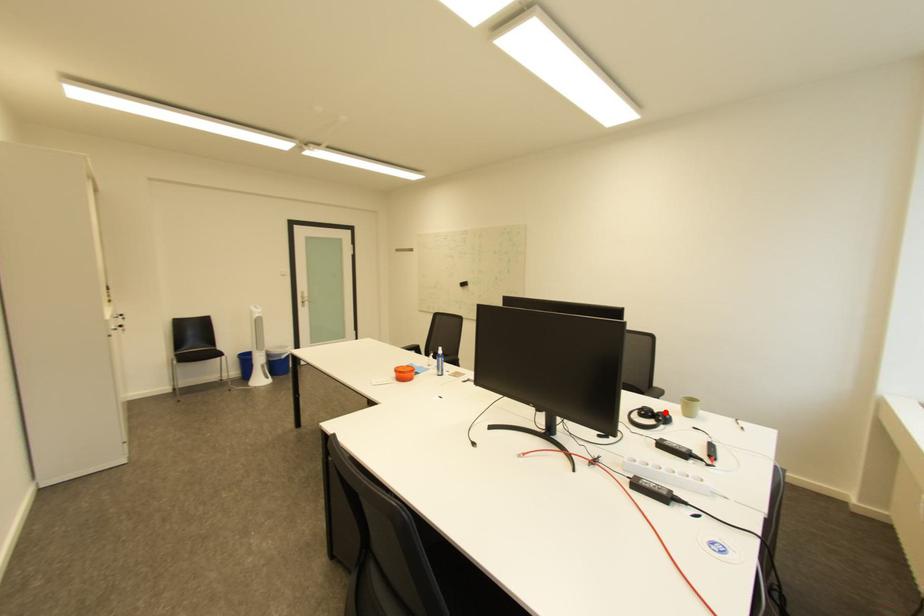
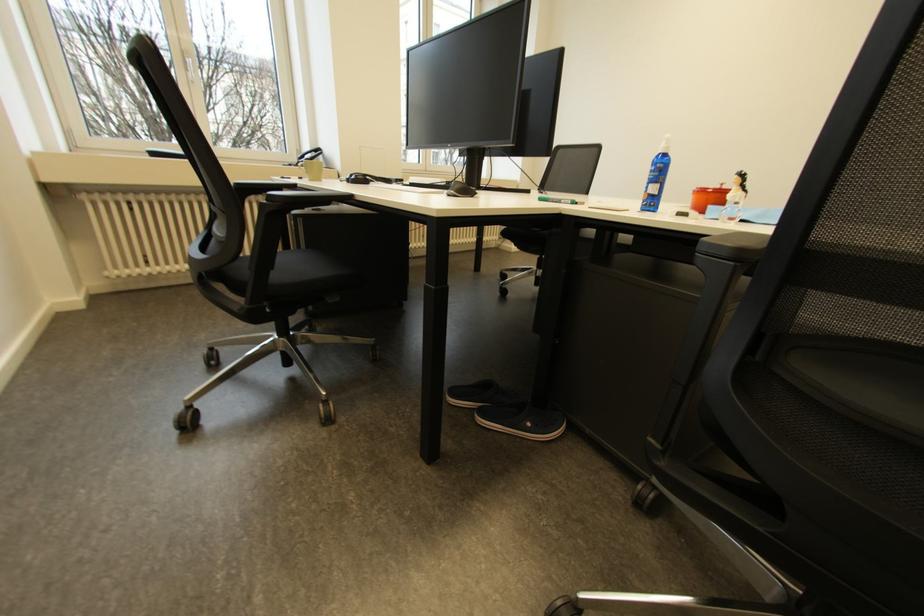
Question: I am providing you with two images of the same scene from different viewpoints. A red point is marked on the first image. Is the red point's position out of view in image 2?

Choices:
 (A) Yes
 (B) No

Answer: (A)